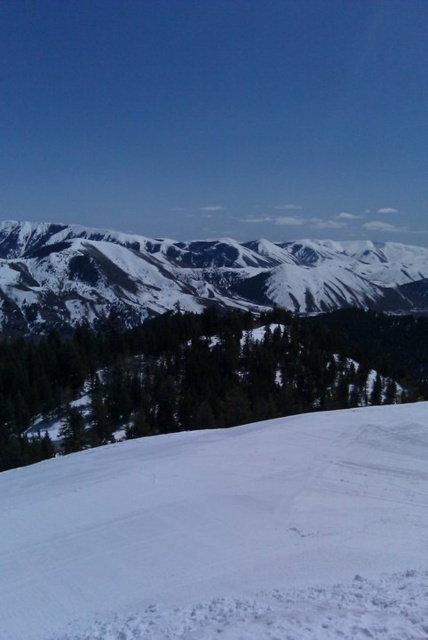
Question: Can you confirm if white snow ski slope at lower center is bigger than white snow-covered mountain at upper center?

Choices:
 (A) yes
 (B) no

Answer: (B)

Question: Can you confirm if white snow ski slope at lower center is smaller than white snow-covered mountain at upper center?

Choices:
 (A) yes
 (B) no

Answer: (A)

Question: Is white snow ski slope at lower center thinner than white snow-covered mountain at upper center?

Choices:
 (A) no
 (B) yes

Answer: (B)